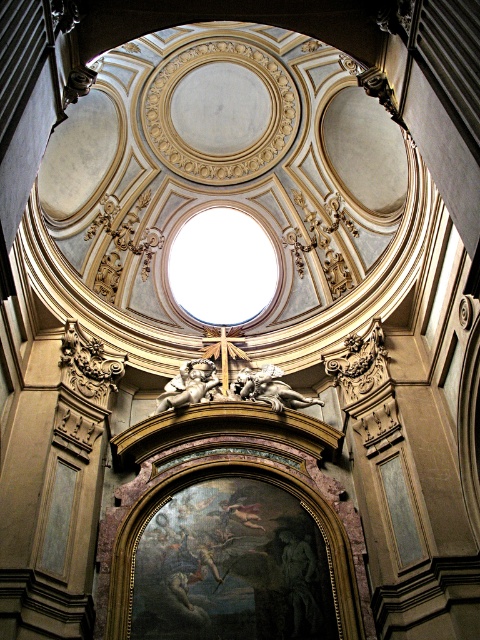
You are standing in the grand cathedral and notice two points marked on the ceiling. The first point is at coordinates point (278, 368) and the second is at point (208, 387). Which point is closer to you?

Point (278, 368) is further to the viewer than point (208, 387), so the second point is closer to you.

You are an architect designing a new cathedral and want to ensure there is enough space between the two cherubs for a large crucifix to be placed between them. The crucifix requires a minimum of 6 meters of space. Based on the image, will the space between the sculpted gold cherub at center and golden metallic cherub at center accommodate the crucifix?

The distance between the sculpted gold cherub at center and golden metallic cherub at center is 6.35 meters, which exceeds the crucifix requirement of 6 meters. Therefore, the space is sufficient to accommodate the crucifix.